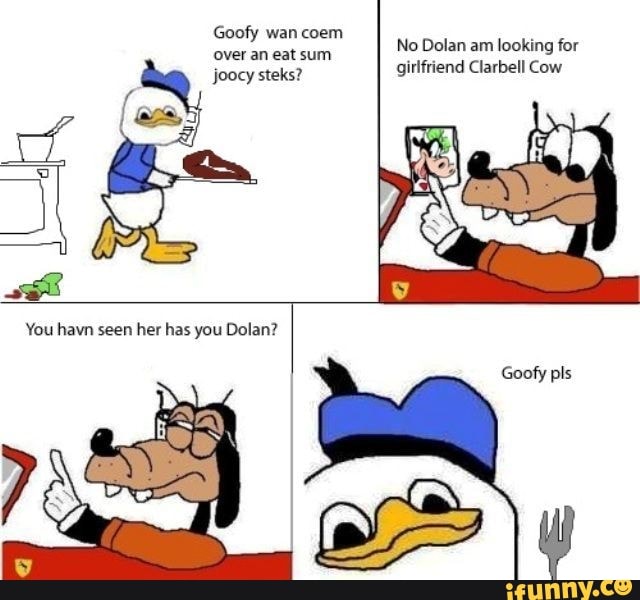
The height and width of the screenshot is (600, 640). In order to click on fork in this screenshot , I will do `click(556, 550)`.